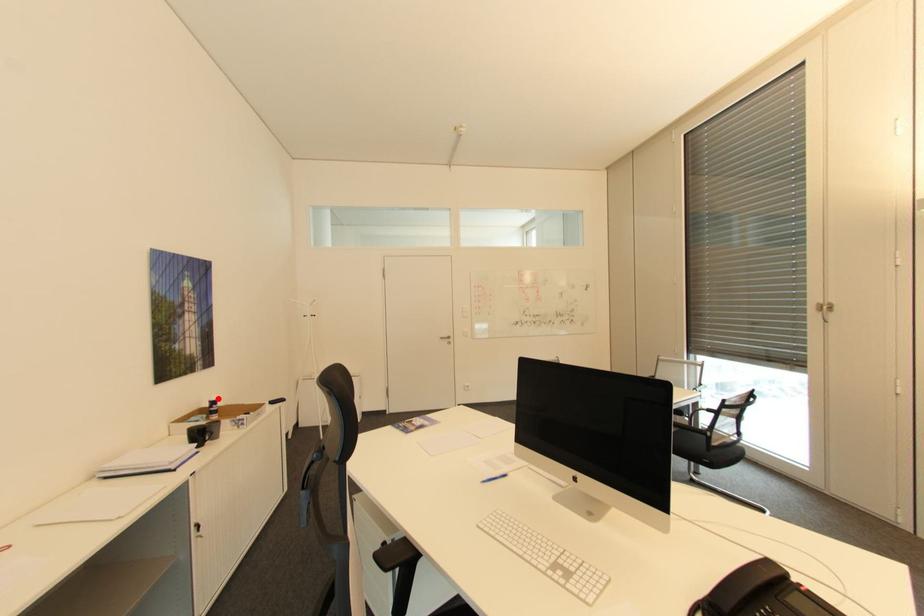
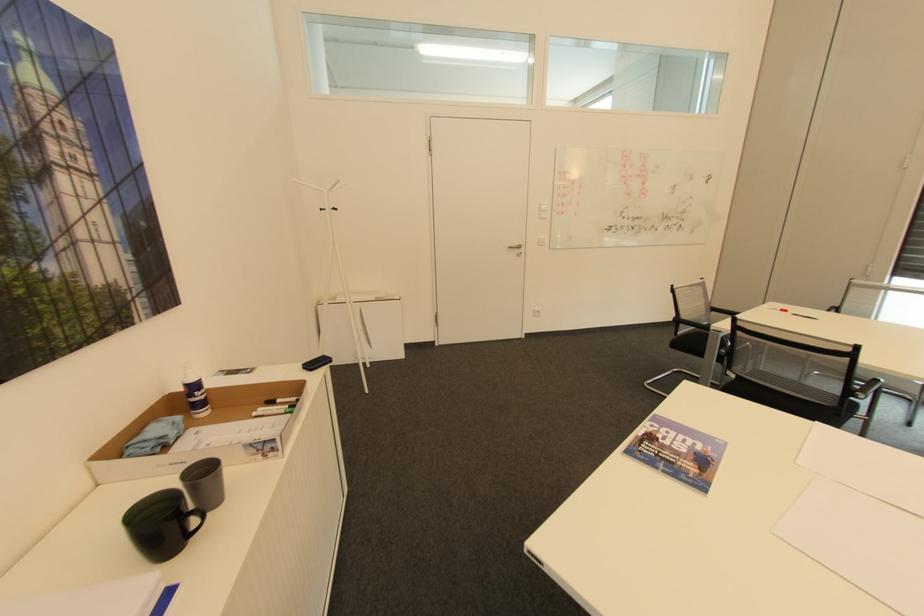
Question: I am providing you with two images of the same scene from different viewpoints. Given a red point in image1, look at the same physical point in image2. Is it:

Choices:
 (A) Closer to the viewpoint
 (B) Farther from the viewpoint

Answer: (A)